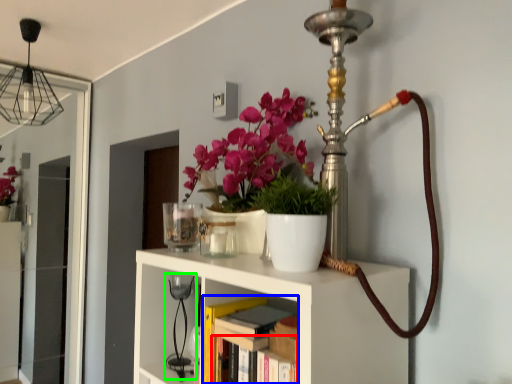
Question: Considering the real-world distances, which object is farthest from book (highlighted by a red box)? book (highlighted by a blue box) or table lamp (highlighted by a green box)?

Choices:
 (A) book
 (B) table lamp

Answer: (B)